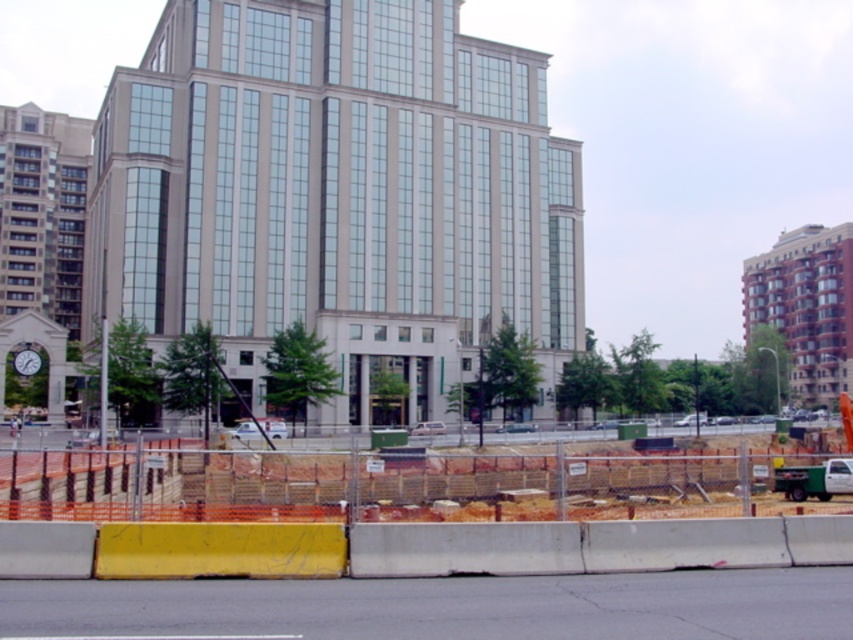
Question: Can you confirm if beige glass building at center is positioned below white hard hat at center?

Choices:
 (A) no
 (B) yes

Answer: (A)

Question: Which of the following is the farthest from the observer?

Choices:
 (A) beige glass building at center
 (B) orange plastic barrier at lower center
 (C) white hard hat at center

Answer: (A)

Question: Is beige glass building at center closer to camera compared to orange plastic barrier at lower center?

Choices:
 (A) no
 (B) yes

Answer: (A)

Question: Which object is the closest to the white hard hat at center?

Choices:
 (A) orange plastic barrier at lower center
 (B) beige glass building at center

Answer: (B)

Question: Where is beige glass building at center located in relation to white hard hat at center in the image?

Choices:
 (A) left
 (B) right

Answer: (B)

Question: Estimate the real-world distances between objects in this image. Which object is closer to the beige glass building at center?

Choices:
 (A) orange plastic barrier at lower center
 (B) white hard hat at center

Answer: (B)